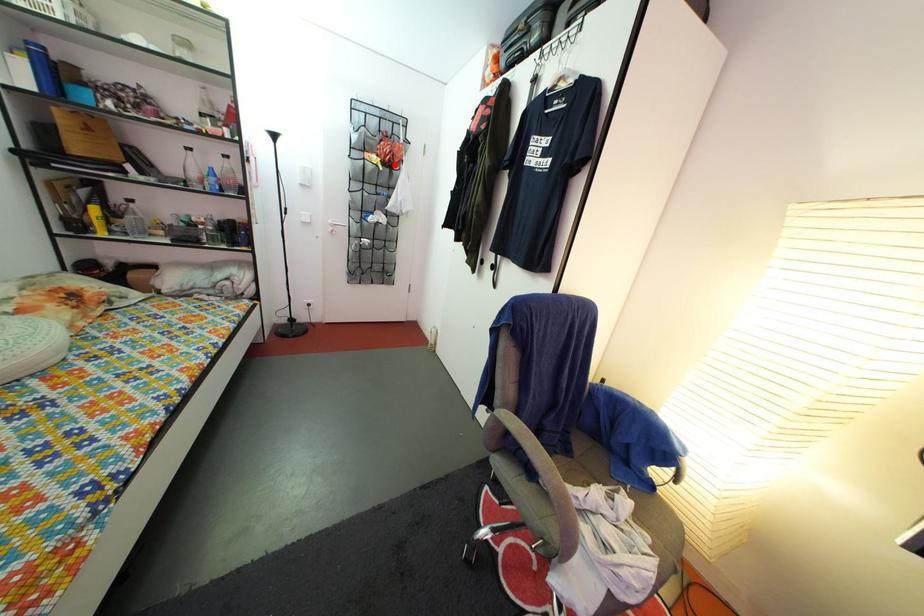
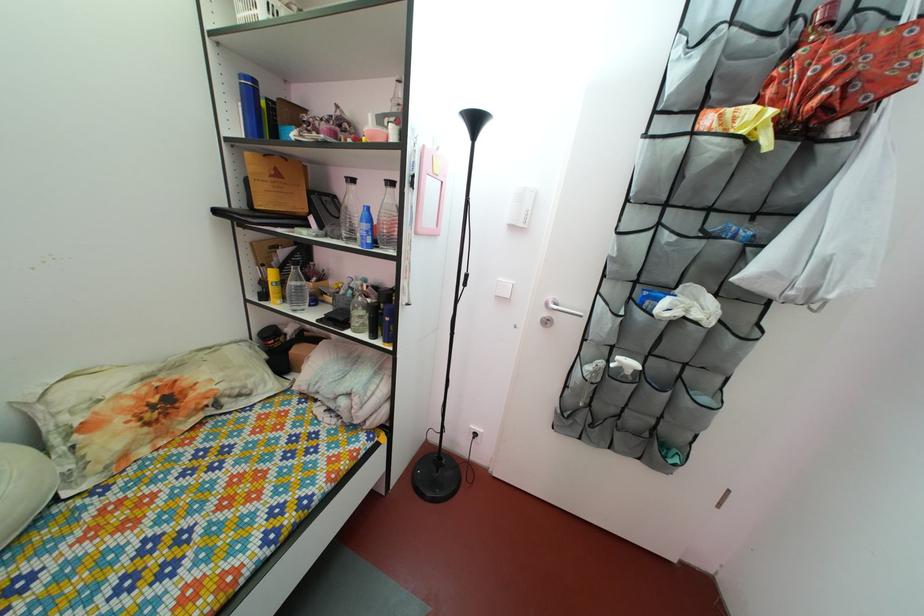
Locate, in the second image, the point that corresponds to the highlighted location in the first image.

(816, 103)